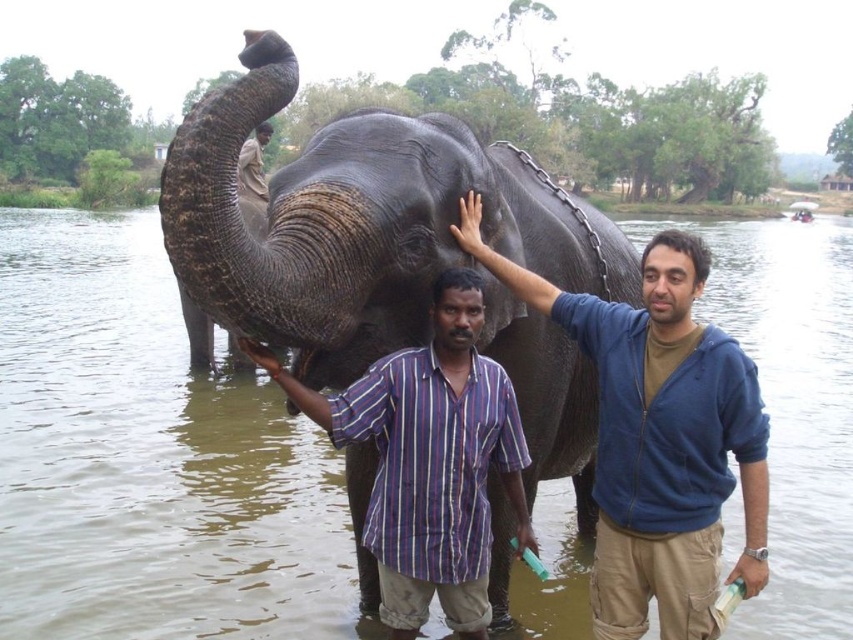
Who is shorter, blue zip-up hoodie at center or brown cotton shirt at upper center?

With less height is brown cotton shirt at upper center.

Looking at this image, does blue zip-up hoodie at center have a lesser height compared to brown cotton shirt at upper center?

No.

Describe the element at coordinates (659, 436) in the screenshot. The width and height of the screenshot is (853, 640). I see `blue zip-up hoodie at center` at that location.

Where is `blue zip-up hoodie at center`? blue zip-up hoodie at center is located at coordinates (659, 436).

What are the coordinates of `blue zip-up hoodie at center` in the screenshot? It's located at (659, 436).

Who is taller, blue zip-up hoodie at center or striped cotton shirt at center?

With more height is blue zip-up hoodie at center.

Between point (660, 616) and point (447, 467), which one is positioned behind?

Positioned behind is point (660, 616).

Find the location of `blue zip-up hoodie at center`. blue zip-up hoodie at center is located at coordinates (659, 436).

Looking at this image, does striped cotton shirt at center appear on the left side of brown cotton shirt at upper center?

Incorrect, striped cotton shirt at center is not on the left side of brown cotton shirt at upper center.

Is striped cotton shirt at center smaller than brown cotton shirt at upper center?

Correct, striped cotton shirt at center occupies less space than brown cotton shirt at upper center.

Locate an element on the screen. The width and height of the screenshot is (853, 640). striped cotton shirt at center is located at coordinates (428, 460).

You are a GUI agent. You are given a task and a screenshot of the screen. Output one action in this format:
    pyautogui.click(x=<x>, y=<y>)
    Task: Click on the striped cotton shirt at center
    This screenshot has height=640, width=853.
    Given the screenshot: What is the action you would take?
    pyautogui.click(x=428, y=460)